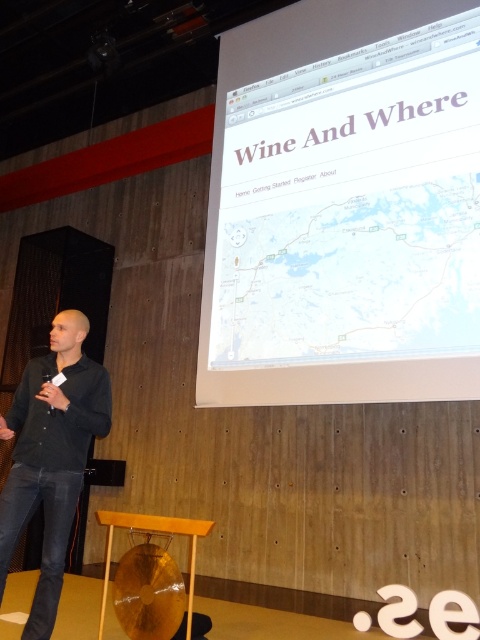
Question: Can you confirm if white paper at upper center is positioned to the right of black matte shirt at left?

Choices:
 (A) no
 (B) yes

Answer: (B)

Question: Does white paper at upper center have a smaller size compared to black matte shirt at left?

Choices:
 (A) no
 (B) yes

Answer: (A)

Question: Is white paper at upper center to the right of black matte shirt at left from the viewer's perspective?

Choices:
 (A) yes
 (B) no

Answer: (A)